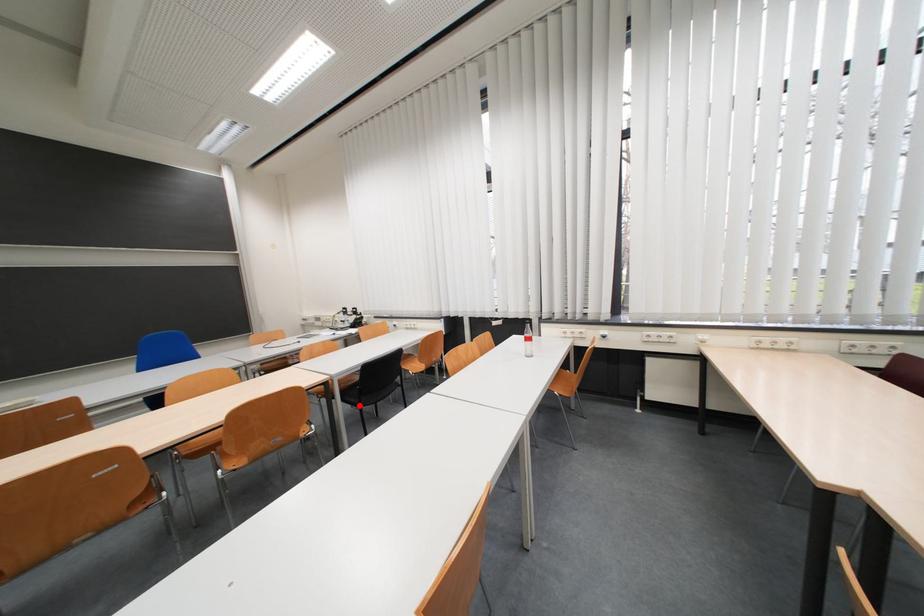
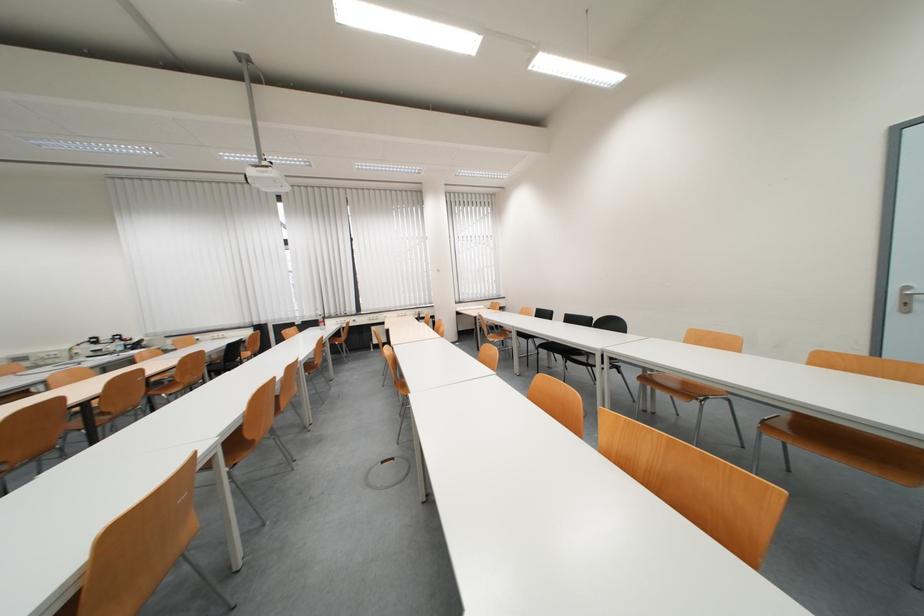
Question: I am providing you with two images of the same scene from different viewpoints. A red point is marked on the first image. At the location where the point appears in image 1, is it still visible in image 2?

Choices:
 (A) Yes
 (B) No

Answer: (B)